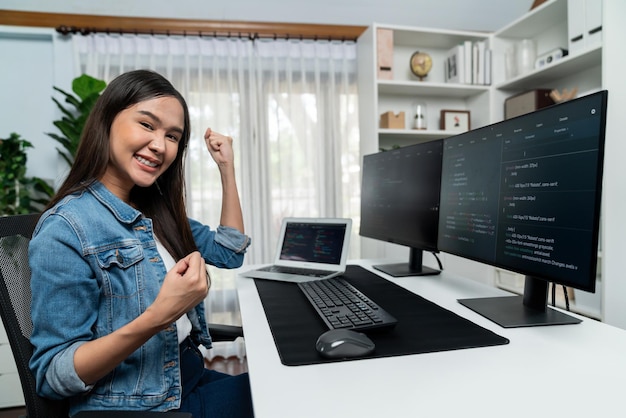
What are the coordinates of `keyboard` in the screenshot? It's located at (332, 302).